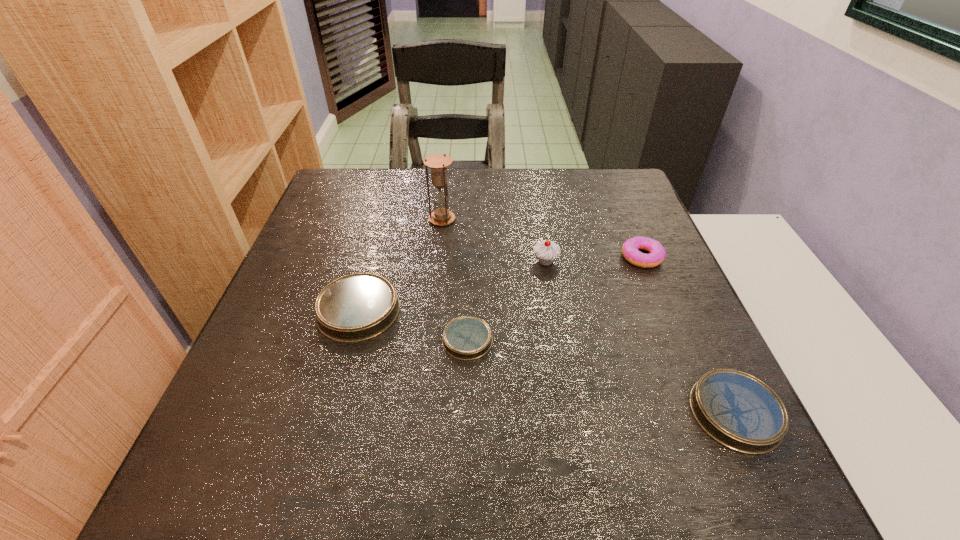
What are the coordinates of `doughnut positioned at the right edge` in the screenshot? It's located at (630, 251).

Find the location of a particular element. The image size is (960, 540). object located in the near right corner section of the desktop is located at coordinates (737, 410).

You are a GUI agent. You are given a task and a screenshot of the screen. Output one action in this format:
    pyautogui.click(x=<x>, y=<y>)
    Task: Click on the vacant space at the far edge of the desktop
    The height and width of the screenshot is (540, 960).
    Given the screenshot: What is the action you would take?
    pyautogui.click(x=536, y=205)

This screenshot has height=540, width=960. In order to click on blank area at the near edge in this screenshot , I will do `click(342, 415)`.

You are a GUI agent. You are given a task and a screenshot of the screen. Output one action in this format:
    pyautogui.click(x=<x>, y=<y>)
    Task: Click on the vacant area at the left edge of the desktop
    
    Given the screenshot: What is the action you would take?
    click(298, 295)

Locate an element on the screen. blank space at the right edge is located at coordinates (597, 218).

At what (x,y) coordinates should I click in order to perform the action: click on free space at the far left corner of the desktop. Please return your answer as a coordinate pair (x, y). Image resolution: width=960 pixels, height=540 pixels. Looking at the image, I should click on point(344,208).

Where is `blank region between the cupcake and the second shortest compass`? Image resolution: width=960 pixels, height=540 pixels. blank region between the cupcake and the second shortest compass is located at coordinates (640, 337).

The image size is (960, 540). Find the location of `empty space between the doughnut and the second tallest object`. empty space between the doughnut and the second tallest object is located at coordinates (593, 259).

Identify the location of free space that is in between the second tallest object and the doughnut. (593, 259).